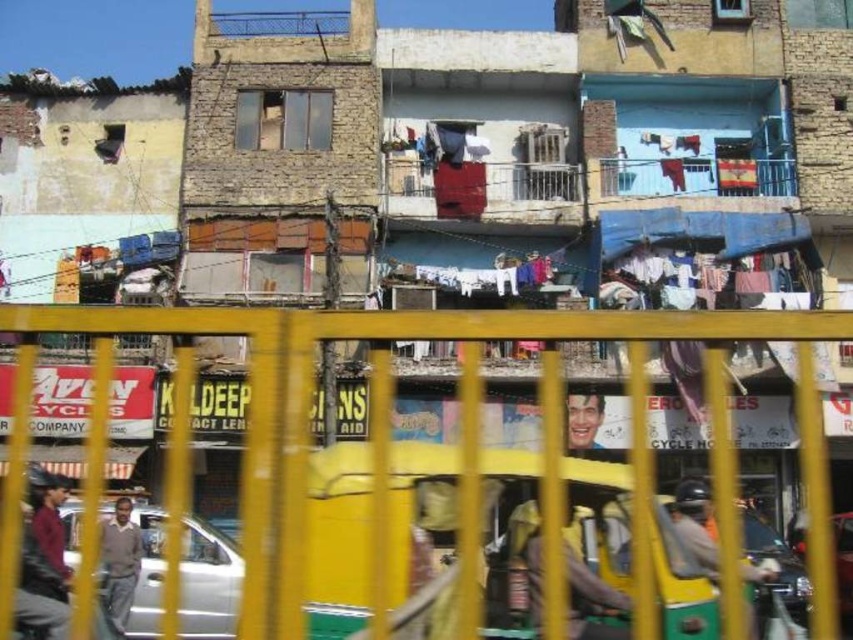
Question: Can you confirm if yellow metal fence at center is wider than shiny silver car at center?

Choices:
 (A) no
 (B) yes

Answer: (B)

Question: Does silver metallic car at lower left appear on the left side of light brown sweater at lower left?

Choices:
 (A) yes
 (B) no

Answer: (B)

Question: Can you confirm if light brown sweater at lower left is positioned below smooth plastic face at center?

Choices:
 (A) no
 (B) yes

Answer: (B)

Question: Which object is the closest to the light brown sweater at lower left?

Choices:
 (A) yellow metal fence at center
 (B) shiny silver car at center

Answer: (A)

Question: Among these points, which one is nearest to the camera?

Choices:
 (A) (461, 404)
 (B) (851, 568)
 (C) (109, 580)
 (D) (592, 428)

Answer: (C)

Question: Which object is the closest to the light brown sweater at lower left?

Choices:
 (A) yellow metal fence at center
 (B) smooth plastic face at center
 (C) shiny silver car at center
 (D) silver metallic car at lower left

Answer: (D)